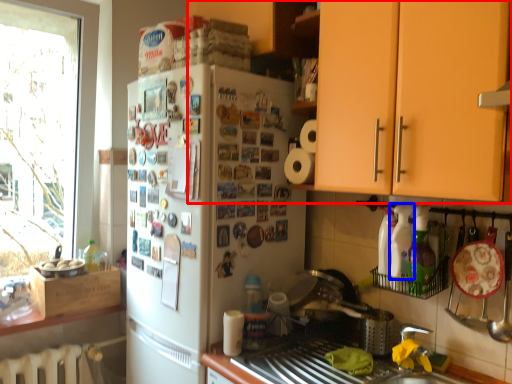
Question: Which object is further to the camera taking this photo, cabinetry (highlighted by a red box) or bottle (highlighted by a blue box)?

Choices:
 (A) cabinetry
 (B) bottle

Answer: (B)